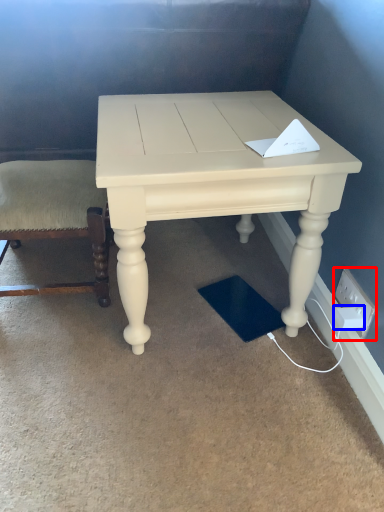
Question: Which of the following is the farthest to the observer, electric outlet (highlighted by a red box) or socket (highlighted by a blue box)?

Choices:
 (A) electric outlet
 (B) socket

Answer: (B)